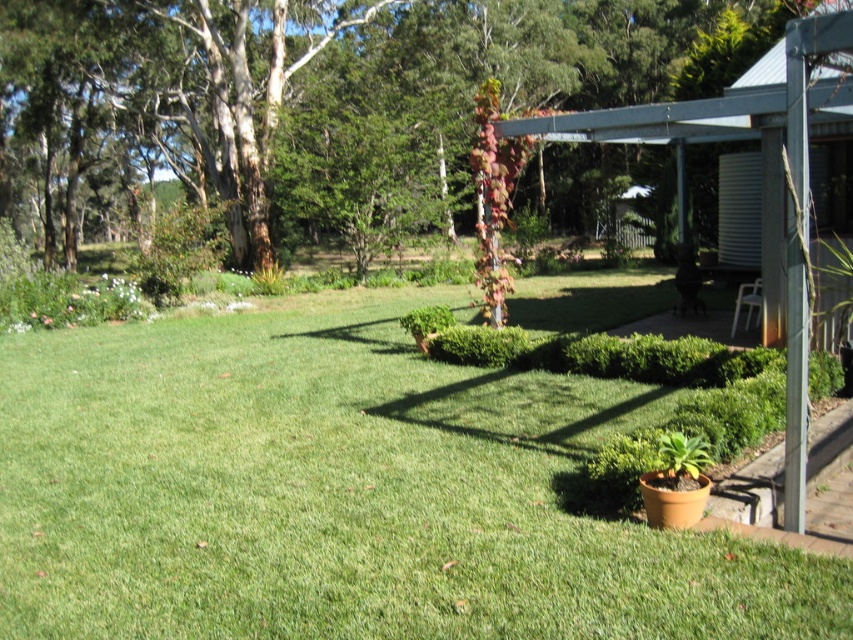
Question: Which of these objects is positioned closest to the metallic gray pergola at upper right?

Choices:
 (A) green grass at lower left
 (B) brown textured tree at upper left

Answer: (A)

Question: Which is farther from the metallic gray pergola at upper right?

Choices:
 (A) brown textured tree at upper left
 (B) green grass at lower left

Answer: (A)

Question: In this image, where is green grass at lower left located relative to metallic gray pergola at upper right?

Choices:
 (A) left
 (B) right

Answer: (A)

Question: Does green grass at lower left come in front of brown textured tree at upper left?

Choices:
 (A) no
 (B) yes

Answer: (B)

Question: Estimate the real-world distances between objects in this image. Which object is closer to the metallic gray pergola at upper right?

Choices:
 (A) green grass at lower left
 (B) brown textured tree at upper left

Answer: (A)

Question: From the image, what is the correct spatial relationship of green grass at lower left in relation to brown textured tree at upper left?

Choices:
 (A) below
 (B) above

Answer: (A)